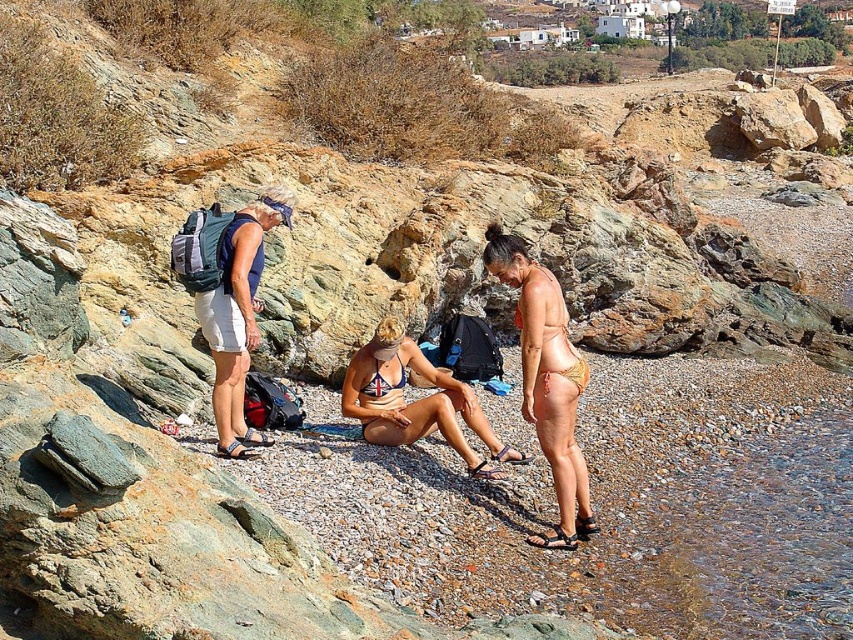
Consider the image. You are standing at the beach and see the blue bikini at center. If you want to reach it within 10 seconds, what is the minimum speed you need to walk?

The blue bikini at center is 51.67 feet away from viewer. To reach it within 10 seconds, you need to walk at a minimum speed of 5.167 feet per second.

You are a photographer trying to capture a photo of both the blue bikini at center and the blue printed bikini top at center. If you want to ensure both are fully visible in the frame, which one should you focus on first considering their widths?

The blue bikini at center is wider than the blue printed bikini top at center, so you should focus on the blue bikini at center first to ensure it fits within the frame.

You are a photographer at the beach and want to capture both the blue bikini at center and the blue printed bikini top at center in a single shot. Which one is positioned lower in the frame?

The blue bikini at center is located below the blue printed bikini top at center, so it is positioned lower in the frame.